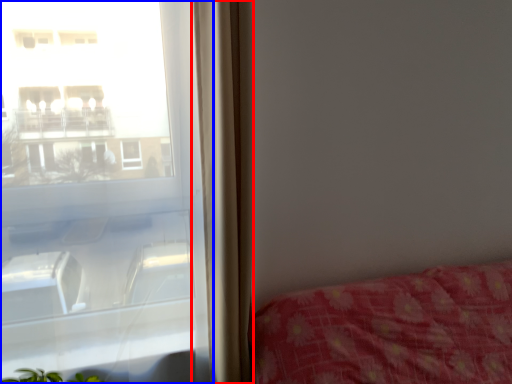
Question: Which object is further to the camera taking this photo, curtain (highlighted by a red box) or window (highlighted by a blue box)?

Choices:
 (A) curtain
 (B) window

Answer: (A)